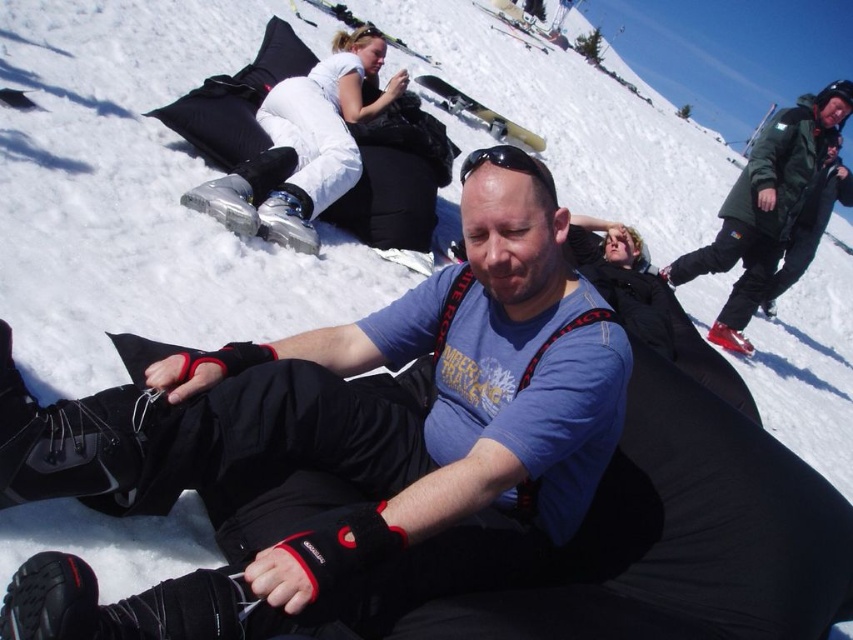
Question: Does matte black gloves at center have a lesser width compared to green matte jacket at upper right?

Choices:
 (A) yes
 (B) no

Answer: (A)

Question: Which point appears farthest from the camera in this image?

Choices:
 (A) (509, 554)
 (B) (741, 307)

Answer: (B)

Question: Where is matte black gloves at center located in relation to green matte jacket at upper right in the image?

Choices:
 (A) below
 (B) above

Answer: (A)

Question: Which of the following is the closest to the observer?

Choices:
 (A) matte black gloves at center
 (B) green matte jacket at upper right

Answer: (A)

Question: Is matte black gloves at center positioned before green matte jacket at upper right?

Choices:
 (A) no
 (B) yes

Answer: (B)